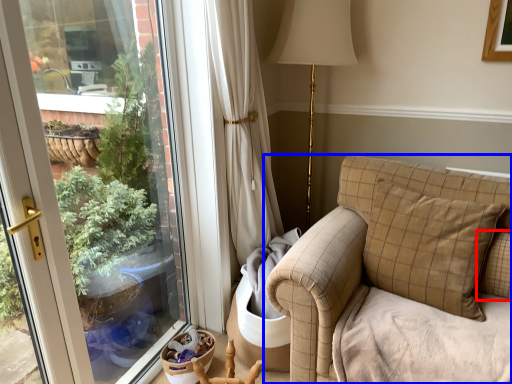
Question: Which of the following is the farthest to the observer, pillow (highlighted by a red box) or studio couch (highlighted by a blue box)?

Choices:
 (A) pillow
 (B) studio couch

Answer: (A)